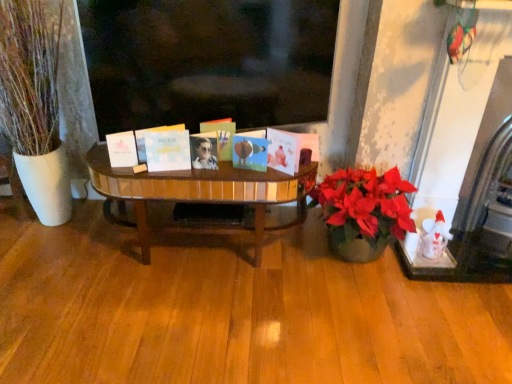
Question: Is matte blue card at center, arranged as the 2th book when viewed from the right, in front of or behind white matte book at center, the fifth book viewed from the left, in the image?

Choices:
 (A) front
 (B) behind

Answer: (B)

Question: Considering the positions of matte blue card at center, arranged as the 4th book when viewed from the left, and white matte book at center, the first book from the right, in the image, is matte blue card at center, arranged as the 4th book when viewed from the left, wider or thinner than white matte book at center, the first book from the right,?

Choices:
 (A) wide
 (B) thin

Answer: (A)

Question: Considering the real-world distances, which object is closest to the white matte book at left, marked as the 1th book in a left-to-right arrangement?

Choices:
 (A) white matte book at center, the first book from the right
 (B) white marble fireplace at right
 (C) metallic photo album at center, placed as the 3th book when sorted from left to right
 (D) matte blue card at center, arranged as the 4th book when viewed from the left
 (E) white matte card at center, positioned as the second book in left-to-right order

Answer: (E)

Question: Which is nearer to the matte blue card at center, arranged as the 4th book when viewed from the left?

Choices:
 (A) white marble fireplace at right
 (B) white matte book at left, marked as the 1th book in a left-to-right arrangement
 (C) metallic photo album at center, placed as the 3th book when sorted from left to right
 (D) matte black sunglasses at center
 (E) white matte book at center, the first book from the right

Answer: (E)